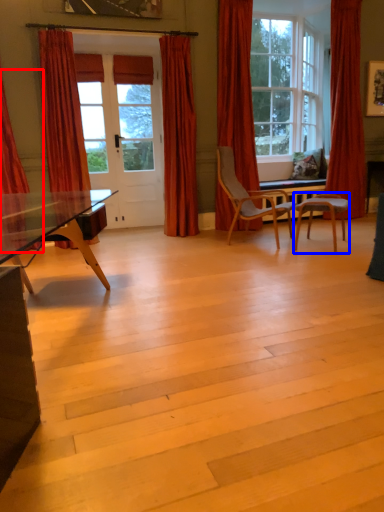
Question: Which point is closer to the camera, curtain (highlighted by a red box) or chair (highlighted by a blue box)?

Choices:
 (A) curtain
 (B) chair

Answer: (A)